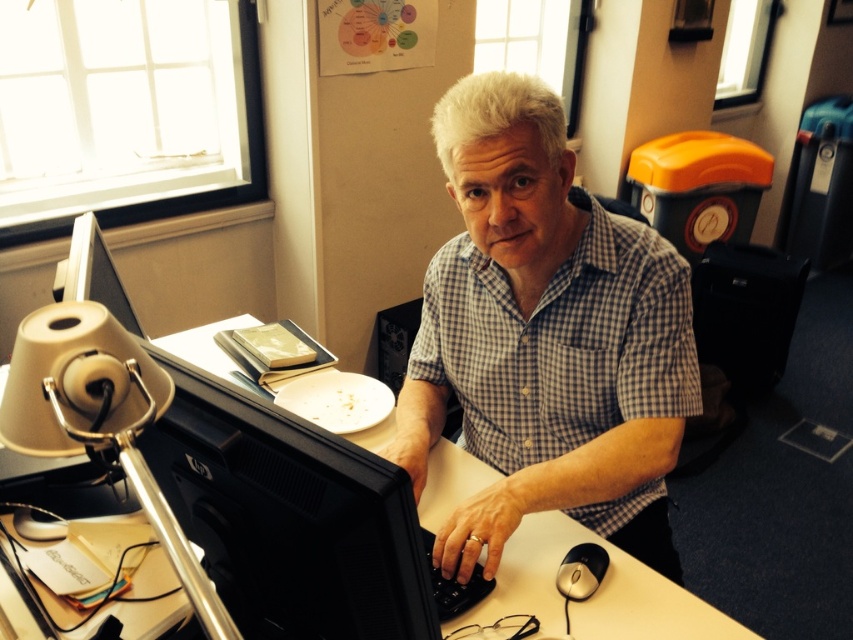
Is matte black monitor at center smaller than black glossy monitor at left?

No, matte black monitor at center is not smaller than black glossy monitor at left.

Is matte black monitor at center to the left of black glossy monitor at left from the viewer's perspective?

Incorrect, matte black monitor at center is not on the left side of black glossy monitor at left.

Who is more forward, (573, 540) or (103, 275)?

Point (573, 540) is more forward.

The image size is (853, 640). Find the location of `matte black monitor at center`. matte black monitor at center is located at coordinates (595, 593).

Which of these two, checkered fabric shirt at center or black plastic keyboard at center, stands taller?

checkered fabric shirt at center is taller.

Which is in front, point (560, 442) or point (428, 564)?

Positioned in front is point (428, 564).

The height and width of the screenshot is (640, 853). What do you see at coordinates (544, 337) in the screenshot? I see `checkered fabric shirt at center` at bounding box center [544, 337].

At what (x,y) coordinates should I click in order to perform the action: click on checkered fabric shirt at center. Please return your answer as a coordinate pair (x, y). The height and width of the screenshot is (640, 853). Looking at the image, I should click on (544, 337).

Which of these two, black plastic monitor at center or black glossy monitor at left, stands shorter?

Standing shorter between the two is black glossy monitor at left.

Where is `black plastic monitor at center`? The width and height of the screenshot is (853, 640). black plastic monitor at center is located at coordinates (289, 516).